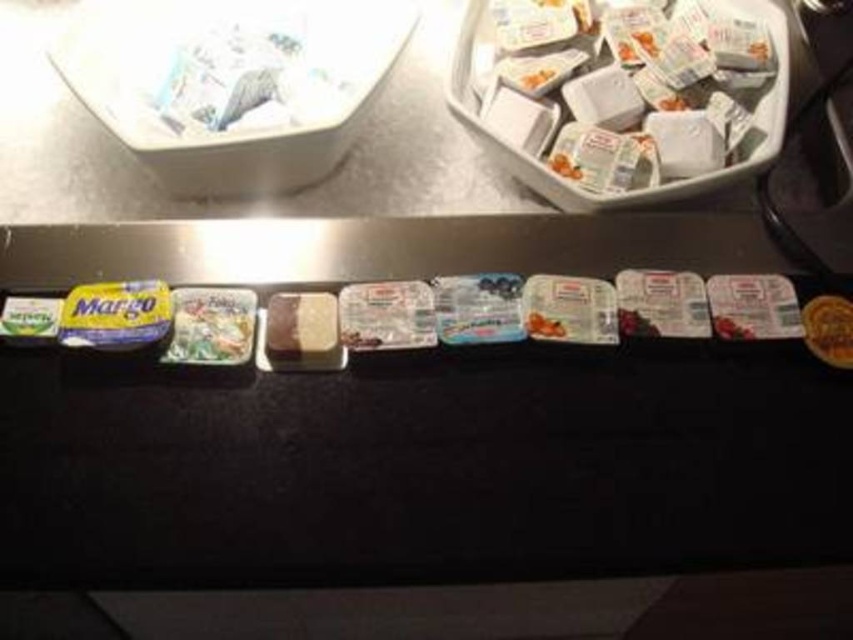
Question: Does white plastic containers at upper right have a lesser width compared to white paper bag at upper left?

Choices:
 (A) yes
 (B) no

Answer: (B)

Question: Which point is farther from the camera taking this photo?

Choices:
 (A) (302, 20)
 (B) (743, 176)

Answer: (A)

Question: Can you confirm if white plastic containers at upper right is thinner than white paper bag at upper left?

Choices:
 (A) no
 (B) yes

Answer: (A)

Question: Can you confirm if white plastic containers at upper right is positioned below white paper bag at upper left?

Choices:
 (A) yes
 (B) no

Answer: (A)

Question: Which of the following is the closest to the observer?

Choices:
 (A) white plastic containers at upper right
 (B) white paper bag at upper left

Answer: (A)